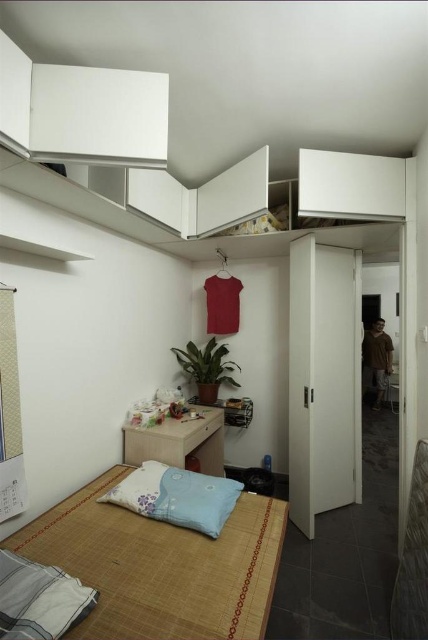
Based on the photo, is blue fabric pillow at lower center closer to camera compared to blue fabric pillow at lower left?

No, it is not.

This screenshot has height=640, width=428. What are the coordinates of `blue fabric pillow at lower center` in the screenshot? It's located at (177, 497).

Does bamboo mat bed at lower left lie in front of blue fabric pillow at lower center?

Yes, it is.

Does bamboo mat bed at lower left appear on the left side of blue fabric pillow at lower center?

No, bamboo mat bed at lower left is not to the left of blue fabric pillow at lower center.

Between point (265, 604) and point (210, 493), which one is positioned in front?

Point (265, 604) is in front.

At what (x,y) coordinates should I click in order to perform the action: click on bamboo mat bed at lower left. Please return your answer as a coordinate pair (x, y). Looking at the image, I should click on (162, 566).

In the scene shown: Who is taller, bamboo mat bed at lower left or blue fabric pillow at lower left?

bamboo mat bed at lower left

Consider the image. Is bamboo mat bed at lower left to the right of blue fabric pillow at lower left from the viewer's perspective?

Answer: Yes, bamboo mat bed at lower left is to the right of blue fabric pillow at lower left.

Is point (202, 612) behind point (59, 632)?

Yes, point (202, 612) is behind point (59, 632).

This screenshot has height=640, width=428. Identify the location of bamboo mat bed at lower left. (162, 566).